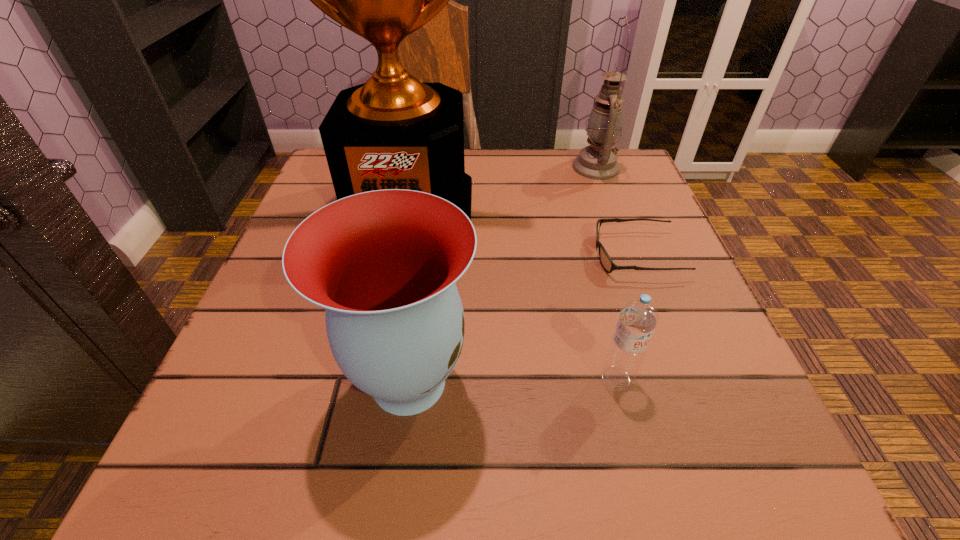
You are a GUI agent. You are given a task and a screenshot of the screen. Output one action in this format:
    pyautogui.click(x=<x>, y=<y>)
    Task: Click on the blank space located 0.050m on the front-facing side of the shortest object
    
    Given the screenshot: What is the action you would take?
    pyautogui.click(x=566, y=255)

At what (x,y) coordinates should I click in order to perform the action: click on vacant space located on the front-facing side of the shortest object. Please return your answer as a coordinate pair (x, y). The width and height of the screenshot is (960, 540). Looking at the image, I should click on (486, 255).

You are a GUI agent. You are given a task and a screenshot of the screen. Output one action in this format:
    pyautogui.click(x=<x>, y=<y>)
    Task: Click on the trophy cup positioned at the far edge
    The width and height of the screenshot is (960, 540).
    Given the screenshot: What is the action you would take?
    pyautogui.click(x=392, y=132)

Identify the location of oil lamp situated at the far edge. (598, 161).

Where is `object located at the near edge`? The height and width of the screenshot is (540, 960). object located at the near edge is located at coordinates (384, 263).

Where is `object that is at the left edge`? object that is at the left edge is located at coordinates (392, 132).

Where is `oil lamp that is at the right edge`? oil lamp that is at the right edge is located at coordinates (598, 161).

The width and height of the screenshot is (960, 540). What are the coordinates of `water bottle located at the right edge` in the screenshot? It's located at (638, 318).

Where is `sunglasses located at the right edge`? sunglasses located at the right edge is located at coordinates (606, 261).

I want to click on object that is at the far left corner, so click(x=392, y=132).